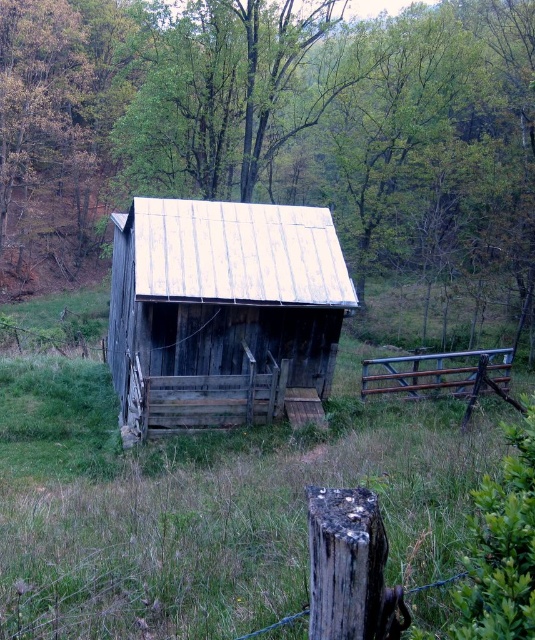
Question: Which object is farther from the camera taking this photo?

Choices:
 (A) weathered wood cabin at center
 (B) brown wooden fence at right
 (C) weathered brown wood at lower center
 (D) green wood tree at center

Answer: (D)

Question: Which object is closer to the camera taking this photo?

Choices:
 (A) weathered brown wood at lower center
 (B) brown wooden fence at right
 (C) green wood tree at center

Answer: (A)

Question: From the image, what is the correct spatial relationship of green wood tree at center in relation to weathered wood cabin at center?

Choices:
 (A) above
 (B) below

Answer: (A)

Question: Which of the following is the closest to the observer?

Choices:
 (A) brown wooden fence at right
 (B) weathered wood cabin at center
 (C) green wood tree at center

Answer: (B)

Question: Does green wood tree at center have a larger size compared to brown wooden fence at right?

Choices:
 (A) yes
 (B) no

Answer: (A)

Question: Does green wood tree at center appear on the left side of weathered wood cabin at center?

Choices:
 (A) yes
 (B) no

Answer: (B)